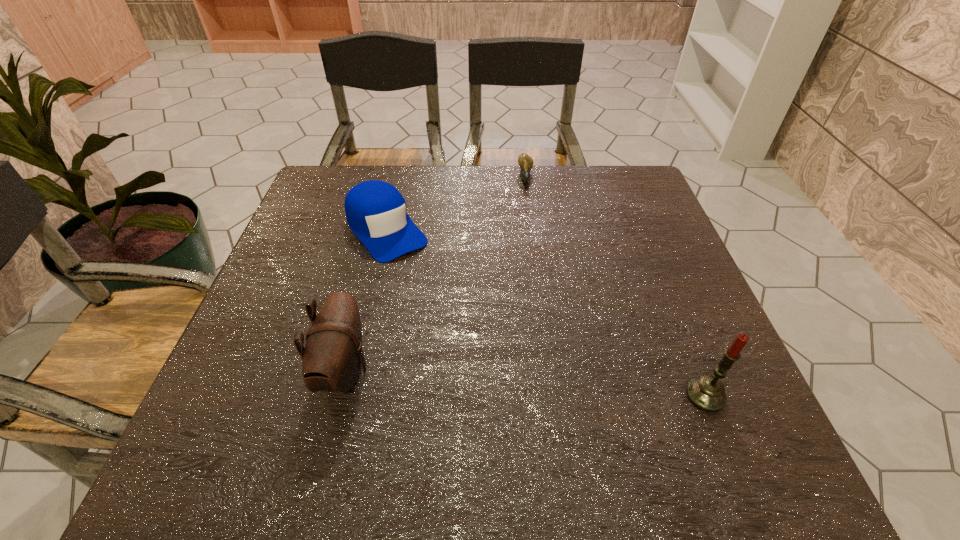
Image resolution: width=960 pixels, height=540 pixels. Find the location of `vacant space on the desktop that is between the pouch and the rightmost object and is positioned on the front-facing side of the third tallest object`. vacant space on the desktop that is between the pouch and the rightmost object and is positioned on the front-facing side of the third tallest object is located at coordinates (513, 382).

Identify the location of free space on the desktop that is between the pouch and the candle and is positioned on the front-facing side of the escargot. (540, 384).